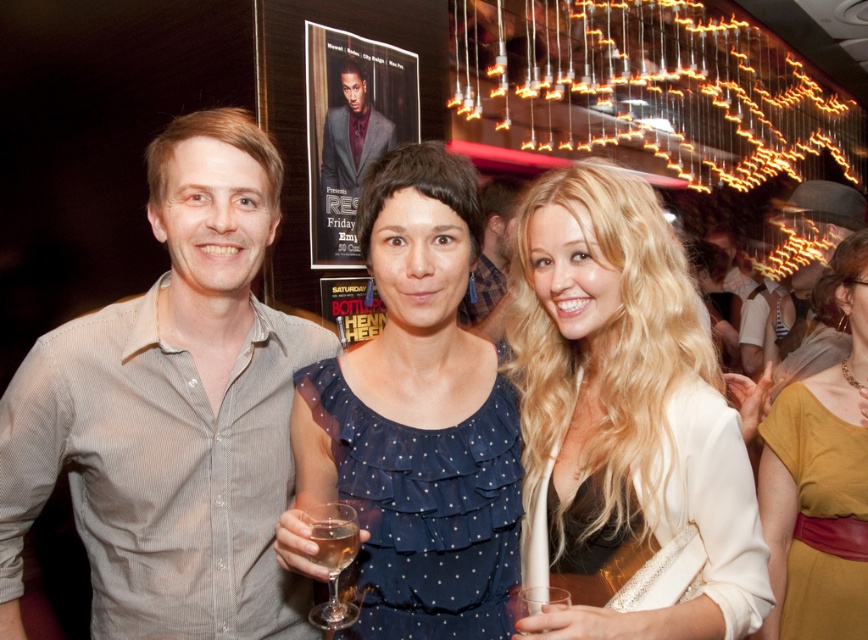
You are at a party and want to take a photo with both the gray striped shirt at center and the light brown leather hat at upper right. Which object should you focus on first if you want to capture both in the same frame without moving your camera?

The gray striped shirt at center has a smaller size compared to light brown leather hat at upper right, so you should focus on the gray striped shirt at center first to ensure both fit in the frame.

You are a photographer at the event and want to take a photo of the blue dotted fabric dress at center and the clear glass wine at center. If your camera has a depth of field that can focus on objects within 25 centimeters of each other, will both items be in focus?

The blue dotted fabric dress at center is 27.19 centimeters away from the clear glass wine at center. Since the distance between them exceeds the 25 centimeter limit, they cannot both be in focus at the same time.

You are at a social event and want to approach the person wearing the gray striped shirt at center. However, there is an obstacle in the way near the light brown leather hat at upper right. Can you reach the person without moving the obstacle?

The gray striped shirt at center is closer to the viewer than the light brown leather hat at upper right, so you can reach the person wearing the gray striped shirt at center first without moving the obstacle near the light brown leather hat at upper right.